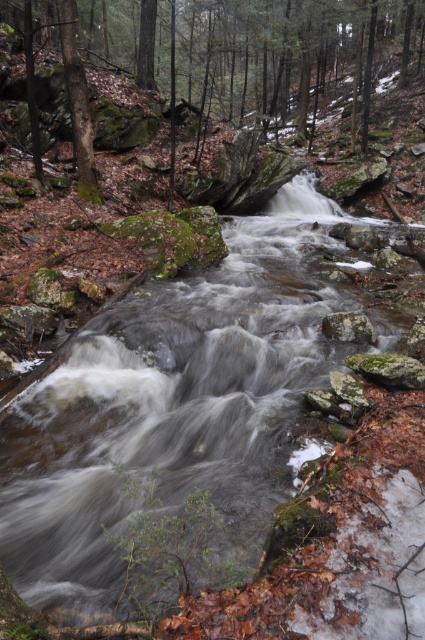
Does green mossy rock at center lie in front of green mossy tree at left?

No, it is not.

Which is in front, point (283, 33) or point (73, 93)?

Point (73, 93)

What are the coordinates of `green mossy rock at center` in the screenshot? It's located at (252, 52).

Can you confirm if smooth rock stream at center is positioned below gray rough rock at center?

Incorrect, smooth rock stream at center is not positioned below gray rough rock at center.

Who is positioned more to the left, smooth rock stream at center or gray rough rock at center?

smooth rock stream at center

Image resolution: width=425 pixels, height=640 pixels. I want to click on smooth rock stream at center, so click(x=173, y=406).

Locate an element on the screen. smooth rock stream at center is located at coordinates (173, 406).

Does smooth rock stream at center have a lesser height compared to green mossy rock at center?

Yes.

The height and width of the screenshot is (640, 425). What do you see at coordinates (173, 406) in the screenshot? I see `smooth rock stream at center` at bounding box center [173, 406].

The image size is (425, 640). In order to click on smooth rock stream at center in this screenshot , I will do `click(173, 406)`.